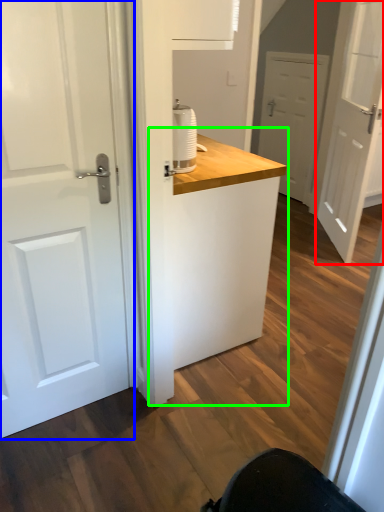
Question: Which is farther away from door (highlighted by a red box)? door (highlighted by a blue box) or counter (highlighted by a green box)?

Choices:
 (A) door
 (B) counter

Answer: (A)